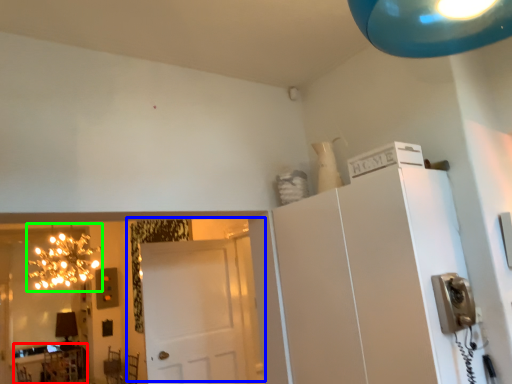
Question: Considering the real-world distances, which object is farthest from table (highlighted by a red box)? door (highlighted by a blue box) or light fixture (highlighted by a green box)?

Choices:
 (A) door
 (B) light fixture

Answer: (A)